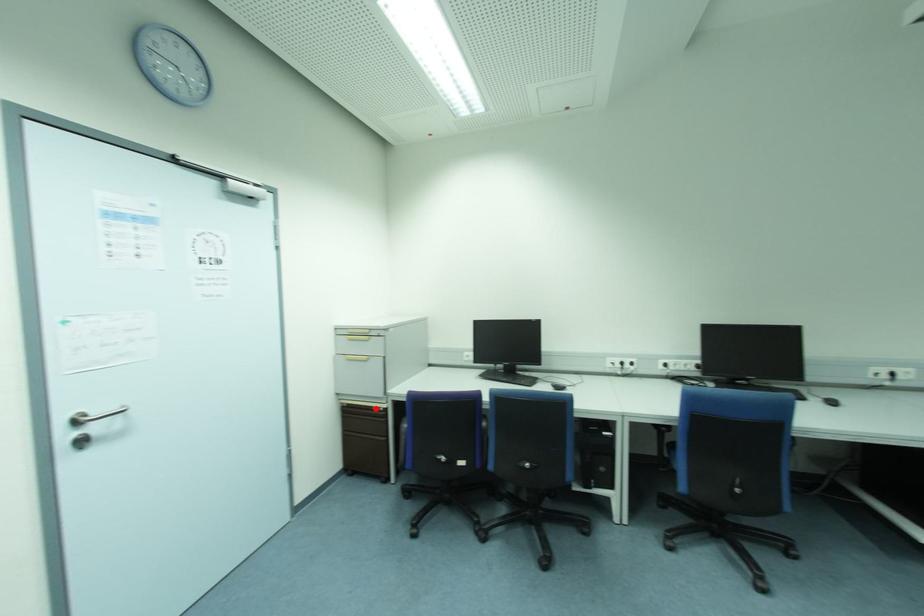
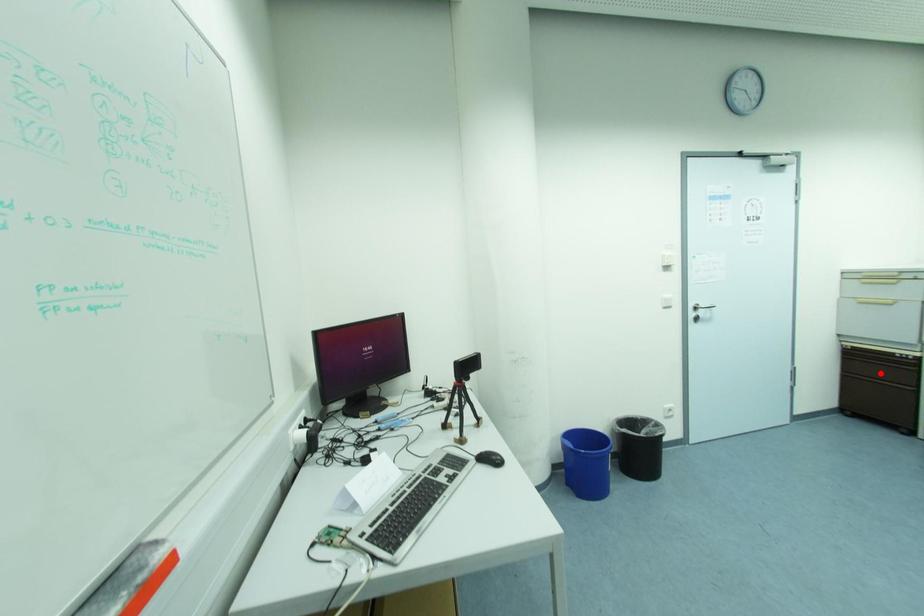
I am providing you with two images of the same scene from different viewpoints. A red point is marked on the first image and another point is marked on the second image. Is the red point in image1 aligned with the point shown in image2?

No